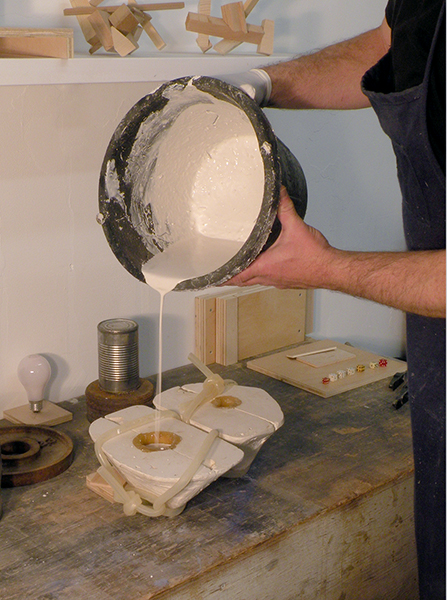
Where is `plaster moulds`? plaster moulds is located at coordinates (182, 454), (240, 415).